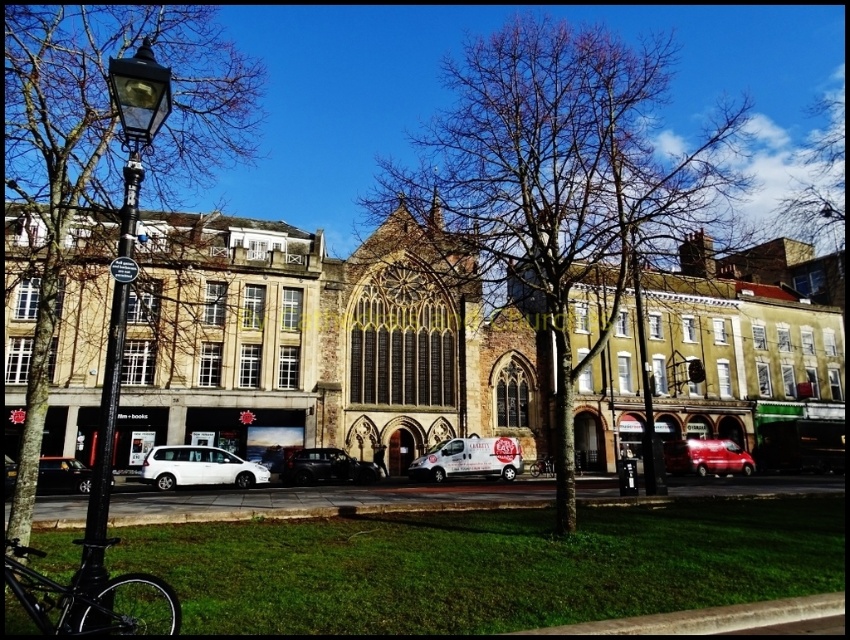
Question: Does bare branches at center appear on the right side of brown leafless tree at left?

Choices:
 (A) yes
 (B) no

Answer: (A)

Question: In this image, where is black metal lamp post at left located relative to white glossy van at center?

Choices:
 (A) left
 (B) right

Answer: (A)

Question: Which object appears closest to the camera in this image?

Choices:
 (A) white glossy van at center
 (B) matte white van at lower left
 (C) black metal lamp post at left

Answer: (C)

Question: Which point is closer to the camera?

Choices:
 (A) bare branches at upper center
 (B) green grass at lower center

Answer: (B)

Question: Considering the real-world distances, which object is farthest from the green grass at lower center?

Choices:
 (A) brown stone church at center
 (B) metallic red van at center-right

Answer: (A)

Question: Does bare branches at center have a lesser width compared to metallic red van at center-right?

Choices:
 (A) no
 (B) yes

Answer: (A)